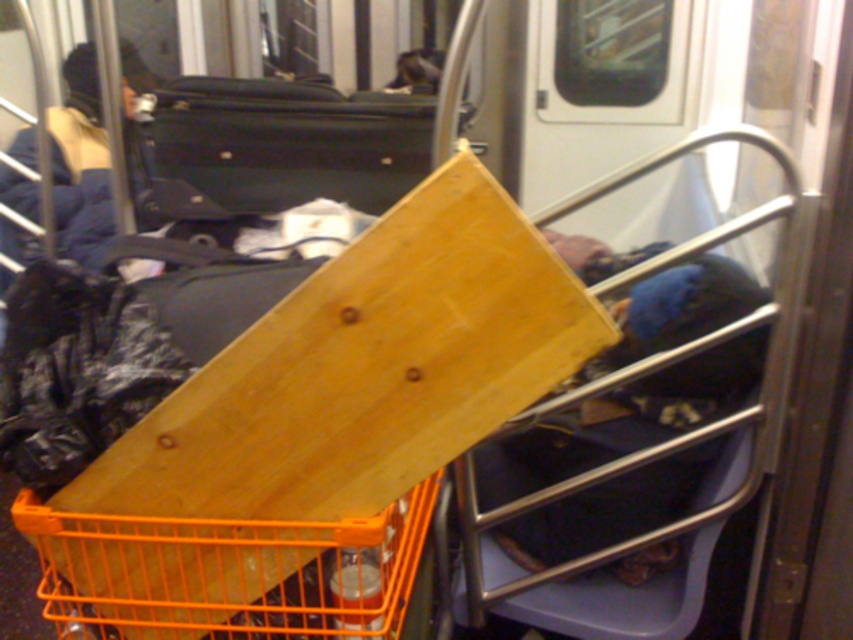
Question: Can you confirm if orange plastic basket at center is positioned below black hard suitcase at upper center?

Choices:
 (A) yes
 (B) no

Answer: (A)

Question: Among these points, which one is nearest to the camera?

Choices:
 (A) (83, 592)
 (B) (358, 147)

Answer: (A)

Question: Does orange plastic basket at center have a larger size compared to black hard suitcase at upper center?

Choices:
 (A) yes
 (B) no

Answer: (B)

Question: Does orange plastic basket at center have a smaller size compared to black hard suitcase at upper center?

Choices:
 (A) no
 (B) yes

Answer: (B)

Question: Which point is closer to the camera?

Choices:
 (A) orange plastic basket at center
 (B) black hard suitcase at upper center

Answer: (A)